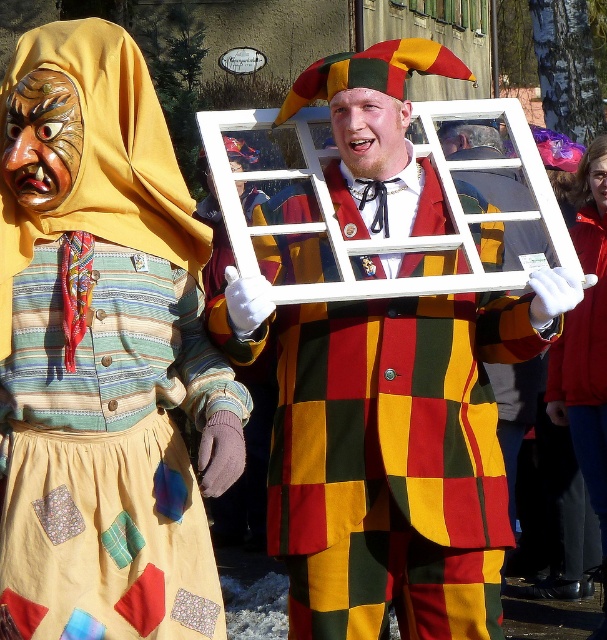
Is matte yellow hood at upper left to the right of matte wooden window frame at center from the viewer's perspective?

No, matte yellow hood at upper left is not to the right of matte wooden window frame at center.

In the scene shown: Who is positioned more to the right, matte yellow hood at upper left or matte wooden window frame at center?

Positioned to the right is matte wooden window frame at center.

In order to click on matte yellow hood at upper left in this screenshot , I will do `click(103, 355)`.